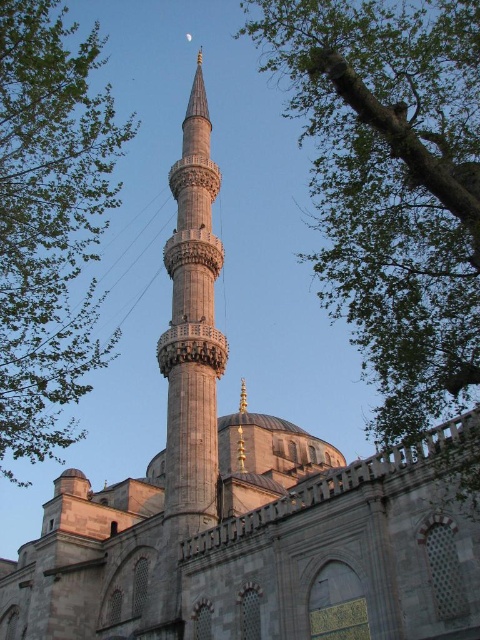
Is green leafy tree at upper left below gray stone minaret at center?

No, green leafy tree at upper left is not below gray stone minaret at center.

Can you confirm if green leafy tree at upper left is taller than gray stone minaret at center?

Yes.

Measure the distance between point (31, 381) and camera.

The distance of point (31, 381) from camera is 60.19 meters.

Find the location of `green leafy tree at upper left`. green leafy tree at upper left is located at coordinates (48, 221).

Is point (446, 13) closer to viewer compared to point (214, 406)?

Yes.

This screenshot has height=640, width=480. I want to click on green leafy tree at upper right, so click(x=392, y=186).

Can you confirm if green leafy tree at upper right is positioned above green leafy tree at upper left?

Incorrect, green leafy tree at upper right is not positioned above green leafy tree at upper left.

Is green leafy tree at upper right thinner than green leafy tree at upper left?

Indeed, green leafy tree at upper right has a lesser width compared to green leafy tree at upper left.

Does point (460, 36) lie in front of point (10, 225)?

Yes, it is in front of point (10, 225).

Where is `green leafy tree at upper right`? The width and height of the screenshot is (480, 640). green leafy tree at upper right is located at coordinates (392, 186).